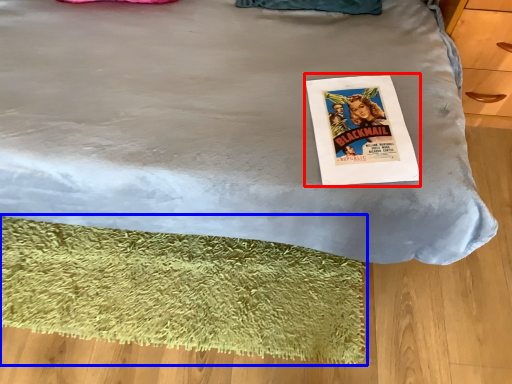
Question: Which object appears farthest to the camera in this image, magazine (highlighted by a red box) or mat (highlighted by a blue box)?

Choices:
 (A) magazine
 (B) mat

Answer: (B)